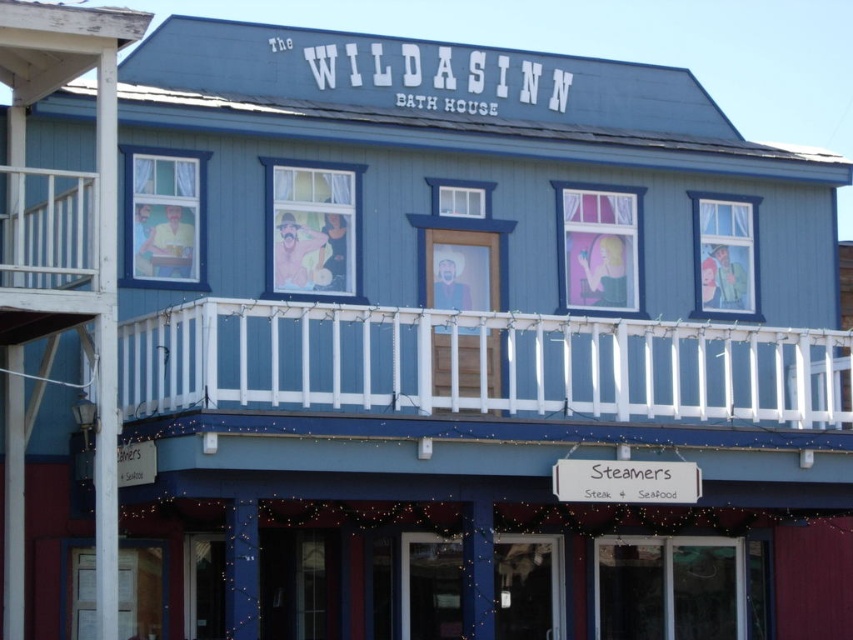
You are standing in front of the building and notice a specific point marked at coordinates [479,364]. What object is located at that point?

The white painted wood at upper center is located at point [479,364].

You are a painter standing on a ladder to paint the white painted wood at upper center and the white wooden railing at upper left. Your ladder can reach up to 40 feet. Can you safely paint both areas without moving the ladder?

The white painted wood at upper center and white wooden railing at upper left are 43.07 feet apart from each other. Since your ladder can only reach up to 40 feet, you cannot safely paint both areas without moving the ladder because the distance between them exceeds the ladder height limit.

You are standing in front of the building and want to hang a small decoration between the white painted wood at upper center and the white wooden railing at upper left. Which object should you place the decoration closer to if you want it to be on the right side from your perspective?

You should place the decoration closer to the white painted wood at upper center because it is positioned on the right side of the white wooden railing at upper left.